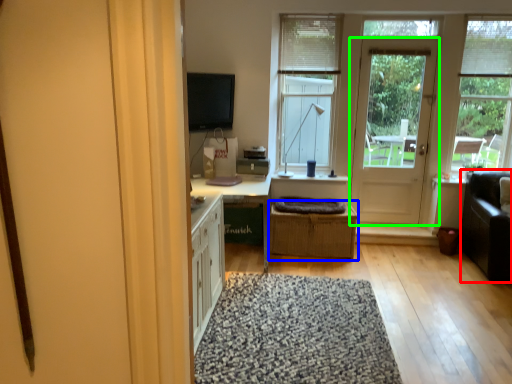
Question: Considering the real-world distances, which object is farthest from couch (highlighted by a red box)? crate (highlighted by a blue box) or door (highlighted by a green box)?

Choices:
 (A) crate
 (B) door

Answer: (A)